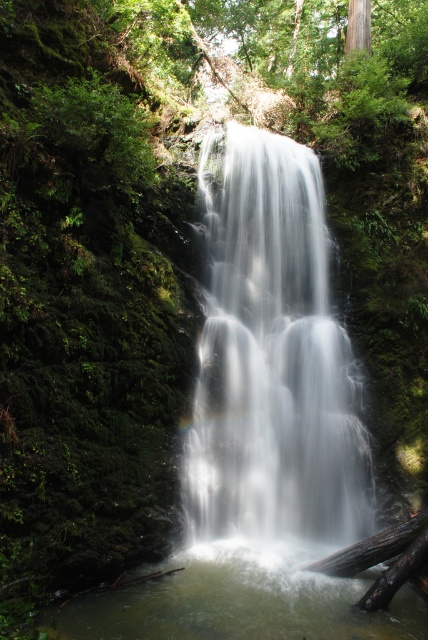
You are a photographer standing at the bottom of the cliff, looking up at the white silky waterfall at center. To capture the waterfall in the center of your photo, where should you aim your camera?

The white silky waterfall at center is located at the 2D coordinates point (273, 360), so you should aim your camera at that point to center the waterfall in your photo.

You are a photographer standing at the bottom of the waterfall, looking up. You notice the white silky waterfall at center and the clear water at center. Which one is located to the right side?

The white silky waterfall at center is positioned on the right side of clear water at center, so it is located to the right side.

You are a photographer planning to capture the waterfall and the clear water in the scene. Based on the description, which of the two, the white silky waterfall at center or the clear water at center, is narrower in width?

The white silky waterfall at center has a lesser width compared to clear water at center, so the white silky waterfall at center is narrower.